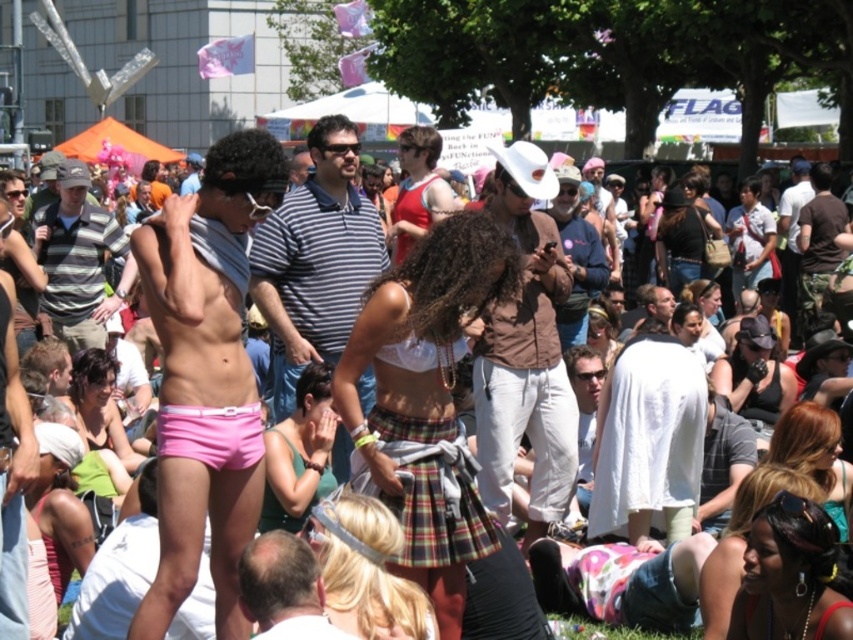
Who is taller, white lace bra at center or matte brown shirt at center?

matte brown shirt at center is taller.

Can you confirm if white lace bra at center is shorter than matte brown shirt at center?

Yes.

You are a GUI agent. You are given a task and a screenshot of the screen. Output one action in this format:
    pyautogui.click(x=<x>, y=<y>)
    Task: Click on the white lace bra at center
    
    Given the screenshot: What is the action you would take?
    pyautogui.click(x=426, y=401)

Does striped cotton shirt at center come behind green grass at lower center?

Yes, it is behind green grass at lower center.

Does striped cotton shirt at center appear over green grass at lower center?

Correct, striped cotton shirt at center is located above green grass at lower center.

Who is more forward, (276, 412) or (666, 637)?

Point (666, 637)

At what (x,y) coordinates should I click in order to perform the action: click on striped cotton shirt at center. Please return your answer as a coordinate pair (x, y). This screenshot has width=853, height=640. Looking at the image, I should click on (315, 259).

Which is above, striped cotton shirt at center or matte black shirt at center?

matte black shirt at center is above.

Where is `striped cotton shirt at center`? striped cotton shirt at center is located at coordinates (315, 259).